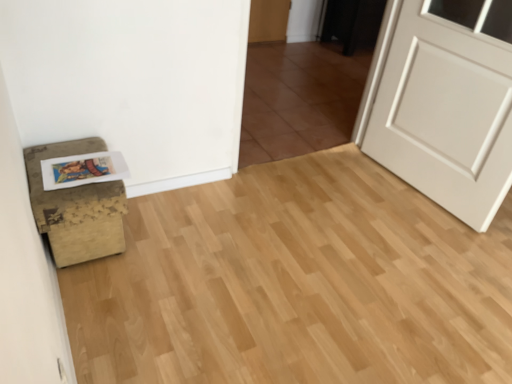
Image resolution: width=512 pixels, height=384 pixels. I want to click on blank space situated above matte paper postcard at lower left (from a real-world perspective), so click(x=81, y=167).